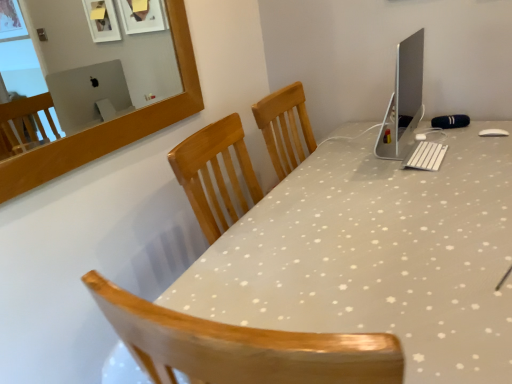
The width and height of the screenshot is (512, 384). In order to click on free space in front of white plastic keyboard at center in this screenshot , I will do `click(459, 177)`.